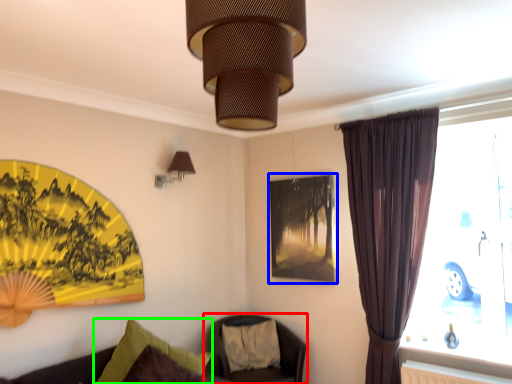
Question: Which is nearer to the chair (highlighted by a red box)? picture frame (highlighted by a blue box) or pillow (highlighted by a green box).

Choices:
 (A) picture frame
 (B) pillow

Answer: (A)